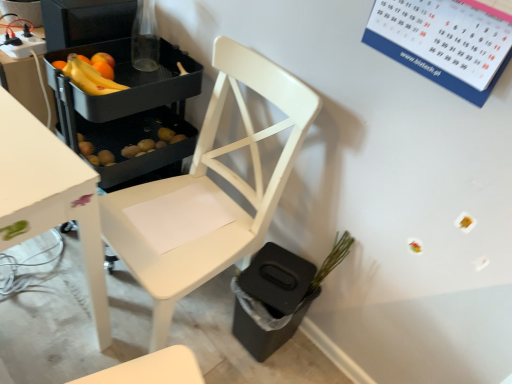
Question: Is white wood chair at center taller or shorter than yellow matte bananas at upper left?

Choices:
 (A) short
 (B) tall

Answer: (B)

Question: Is white wood chair at center in front of or behind yellow matte bananas at upper left in the image?

Choices:
 (A) front
 (B) behind

Answer: (A)

Question: Considering the real-world distances, which object is closest to the white wood chair at center?

Choices:
 (A) matte black tray at upper left
 (B) green matte plant at lower right
 (C) yellow matte bananas at upper left

Answer: (B)

Question: Which object is the closest to the matte black tray at upper left?

Choices:
 (A) white wood chair at center
 (B) green matte plant at lower right
 (C) yellow matte bananas at upper left

Answer: (C)